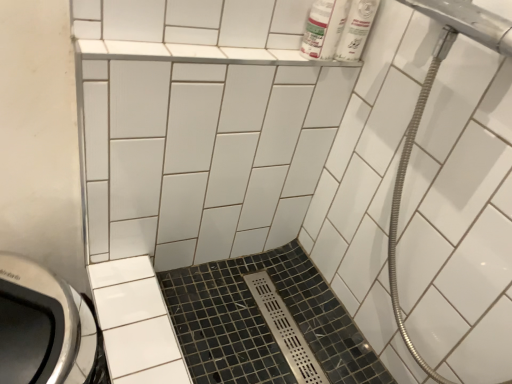
Question: Does metallic silver showerhead at upper right lie in front of white glossy ceramic tile at upper center, which is the second ceramic tile from bottom to top?

Choices:
 (A) yes
 (B) no

Answer: (A)

Question: Can you confirm if metallic silver showerhead at upper right is positioned to the right of white glossy ceramic tile at upper center, which is the second ceramic tile from bottom to top?

Choices:
 (A) no
 (B) yes

Answer: (B)

Question: Can you confirm if metallic silver showerhead at upper right is thinner than white glossy ceramic tile at upper center, which is the second ceramic tile from bottom to top?

Choices:
 (A) no
 (B) yes

Answer: (A)

Question: From a real-world perspective, is metallic silver showerhead at upper right below white glossy ceramic tile at upper center, marked as the first ceramic tile in a top-to-bottom arrangement?

Choices:
 (A) yes
 (B) no

Answer: (B)

Question: Is the surface of metallic silver showerhead at upper right in direct contact with white glossy ceramic tile at upper center, which is the second ceramic tile from bottom to top?

Choices:
 (A) yes
 (B) no

Answer: (B)

Question: Can you confirm if metallic silver showerhead at upper right is wider than white glossy ceramic tile at upper center, marked as the first ceramic tile in a top-to-bottom arrangement?

Choices:
 (A) yes
 (B) no

Answer: (A)

Question: Is white plastic bottles at upper right aimed at white glossy ceramic tile at upper center, which is the second ceramic tile from bottom to top?

Choices:
 (A) no
 (B) yes

Answer: (A)

Question: Can we say white plastic bottles at upper right lies outside white glossy ceramic tile at upper center, marked as the first ceramic tile in a top-to-bottom arrangement?

Choices:
 (A) no
 (B) yes

Answer: (B)

Question: From the image's perspective, would you say white plastic bottles at upper right is shown under white glossy ceramic tile at upper center, marked as the first ceramic tile in a top-to-bottom arrangement?

Choices:
 (A) no
 (B) yes

Answer: (A)

Question: From a real-world perspective, is white plastic bottles at upper right below white glossy ceramic tile at upper center, which is the second ceramic tile from bottom to top?

Choices:
 (A) no
 (B) yes

Answer: (A)

Question: From a real-world perspective, is white plastic bottles at upper right over white glossy ceramic tile at upper center, which is the second ceramic tile from bottom to top?

Choices:
 (A) no
 (B) yes

Answer: (B)

Question: From the image's perspective, is white plastic bottles at upper right above white glossy ceramic tile at upper center, marked as the first ceramic tile in a top-to-bottom arrangement?

Choices:
 (A) yes
 (B) no

Answer: (A)

Question: Is the position of metallic silver showerhead at upper right less distant than that of white plastic bottles at upper right?

Choices:
 (A) yes
 (B) no

Answer: (A)